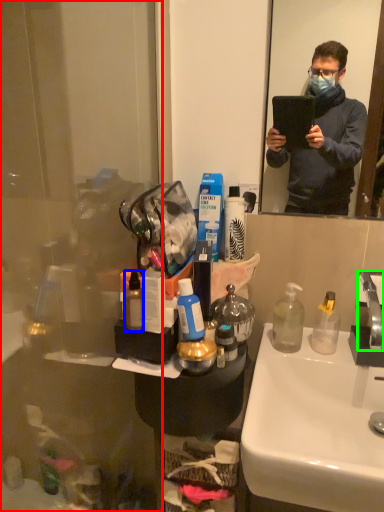
Question: Considering the real-world distances, which object is closest to glass door (highlighted by a red box)? toiletries (highlighted by a blue box) or faucet (highlighted by a green box).

Choices:
 (A) toiletries
 (B) faucet

Answer: (A)